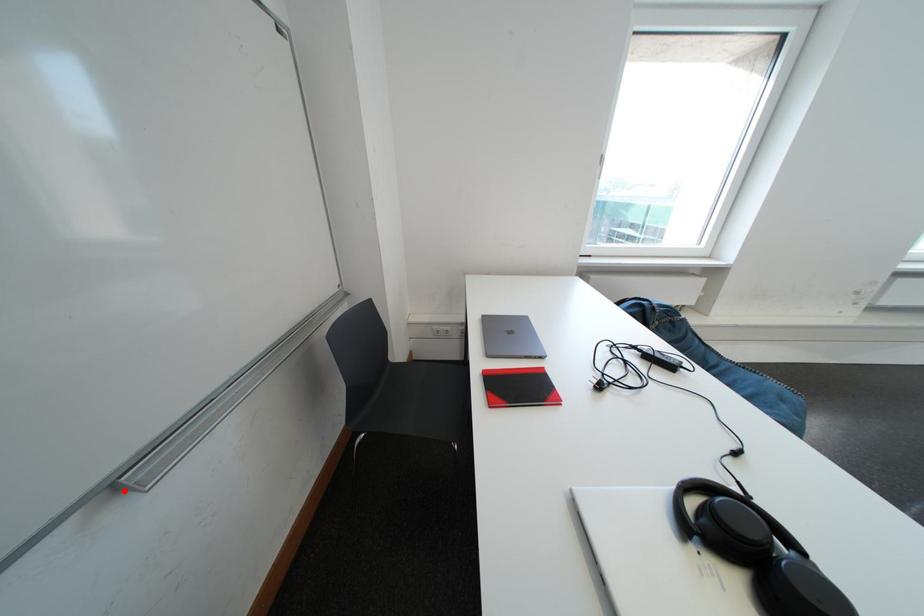
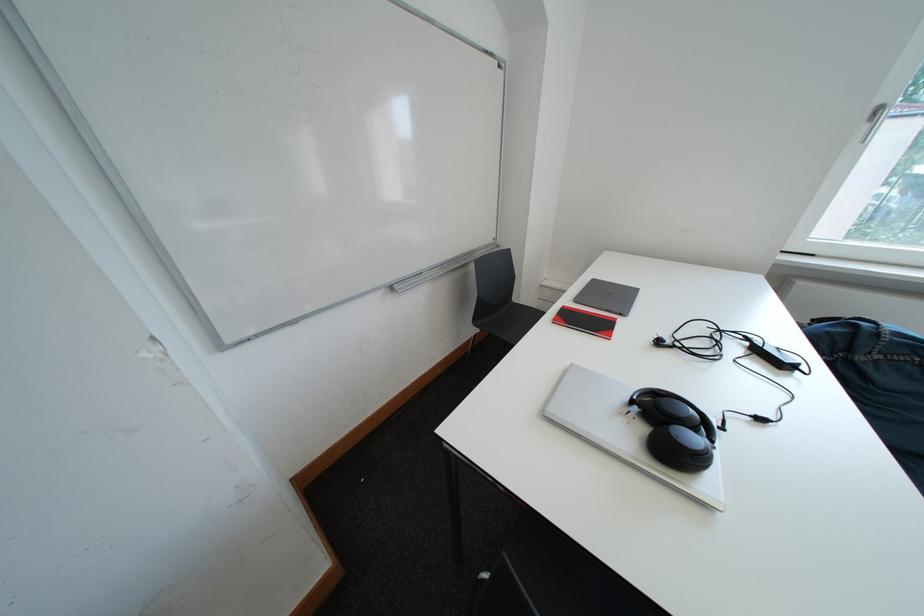
Find the pixel in the second image that matches the highlighted location in the first image.

(403, 292)